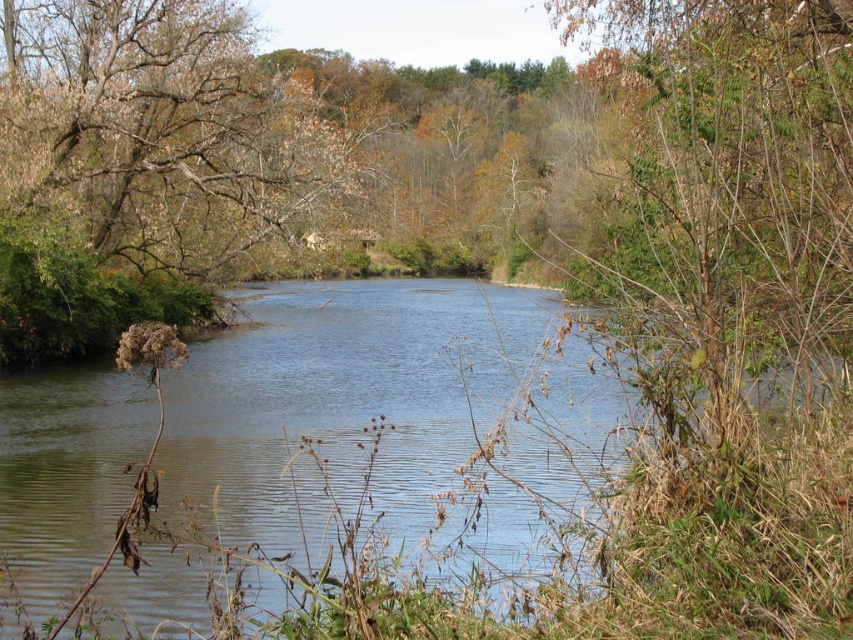
You are a small boat that is 2 meters long. You are currently floating on the clear water at center and want to reach the brown leafy tree at upper left. Can you safely navigate to it without getting stuck?

The distance between the clear water at center and the brown leafy tree at upper left is 9.18 meters. Since the boat is 2 meters long, it can navigate the 9.18 meter gap without issue, so yes, it can safely reach the brown leafy tree at upper left.

You are standing at the point with coordinates point (259,99) and want to reach the point with coordinates point (91,531). Based on the scene description, which direction should you move to get closer to your destination?

You should move forward because point (91,531) is in front of point (259,99).

You are standing on the riverbank and want to cross the river to the other side. You have a small boat that is 2 meters long. The clear water at center is where you plan to navigate. Considering the height of the brown leafy tree at upper left, do you think the boat will fit under it without hitting the branches?

The clear water at center is shorter than the brown leafy tree at upper left, meaning the tree is taller. Since the boat is 2 meters long, its height is not specified, but the question is about fitting under the branches. Assuming the boat is low enough, the tree being taller would allow the boat to pass underneath without hitting the branches, provided there is sufficient clearance. However, the exact height difference isn not provided, so it depends on the tree being tall enough to accommodate the boat.